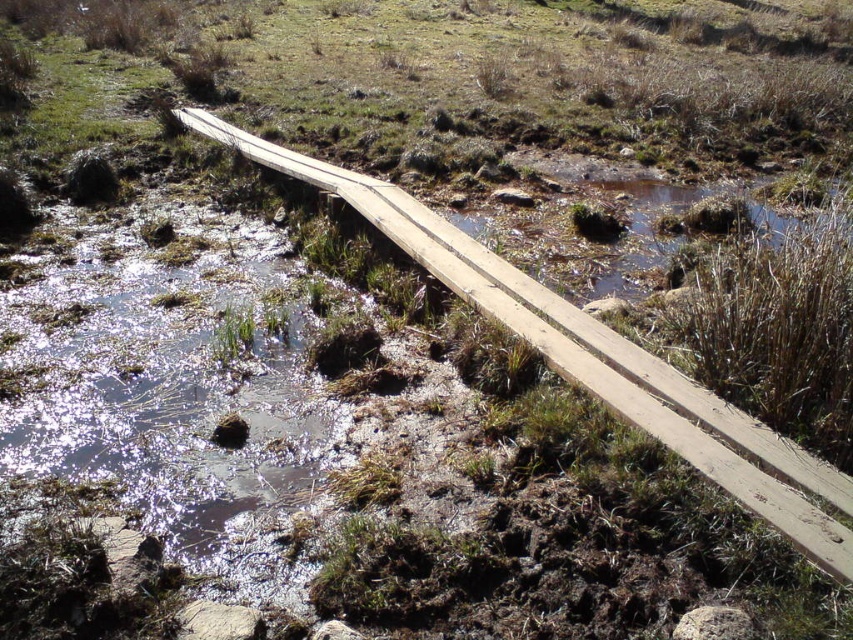
Question: Is shiny mud water at lower left positioned in front of wooden bridge at center?

Choices:
 (A) yes
 (B) no

Answer: (A)

Question: Which of the following is the closest to the observer?

Choices:
 (A) (408, 204)
 (B) (252, 291)

Answer: (B)

Question: Is shiny mud water at lower left further to the viewer compared to wooden bridge at center?

Choices:
 (A) no
 (B) yes

Answer: (A)

Question: Among these objects, which one is farthest from the camera?

Choices:
 (A) shiny mud water at lower left
 (B) wooden bridge at center

Answer: (B)

Question: Is shiny mud water at lower left thinner than wooden bridge at center?

Choices:
 (A) no
 (B) yes

Answer: (A)

Question: Which of the following is the farthest from the observer?

Choices:
 (A) (677, 385)
 (B) (38, 356)

Answer: (B)